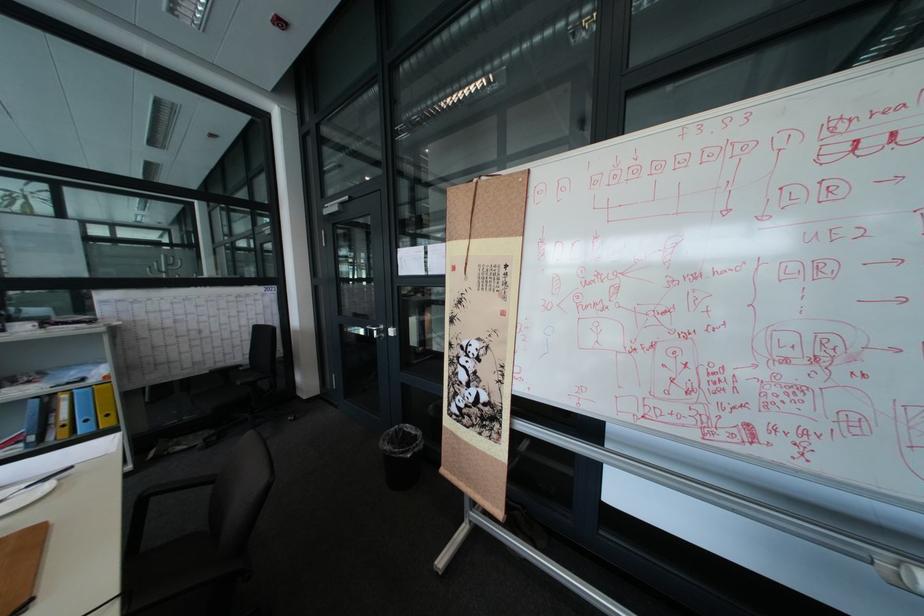
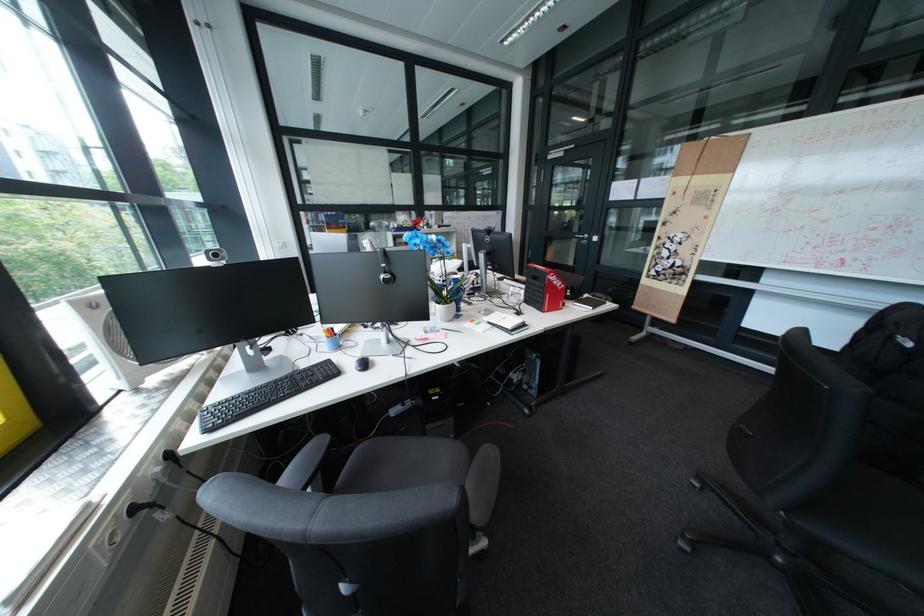
In the second image, find the point that corresponds to (393,338) in the first image.

(598, 243)